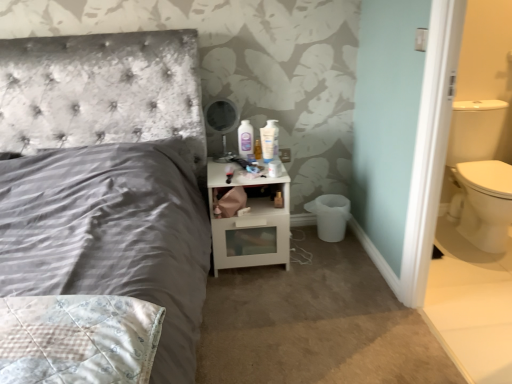
Question: Is white matte toilet paper at lower right looking in the opposite direction of white glossy mouthwash at upper center?

Choices:
 (A) no
 (B) yes

Answer: (A)

Question: From the image's perspective, does white matte toilet paper at lower right appear higher than white glossy mouthwash at upper center?

Choices:
 (A) no
 (B) yes

Answer: (A)

Question: Can you confirm if white matte toilet paper at lower right is smaller than white glossy mouthwash at upper center?

Choices:
 (A) no
 (B) yes

Answer: (B)

Question: Considering the relative sizes of white matte toilet paper at lower right and white glossy mouthwash at upper center in the image provided, is white matte toilet paper at lower right taller than white glossy mouthwash at upper center?

Choices:
 (A) yes
 (B) no

Answer: (B)

Question: Is white matte toilet paper at lower right wider than white glossy mouthwash at upper center?

Choices:
 (A) yes
 (B) no

Answer: (B)

Question: Is white matte toilet paper at lower right in front of white glossy mouthwash at upper center?

Choices:
 (A) no
 (B) yes

Answer: (B)

Question: Is white glossy nightstand at center to the left of white glossy mouthwash at upper center from the viewer's perspective?

Choices:
 (A) yes
 (B) no

Answer: (A)

Question: From the image's perspective, is white glossy nightstand at center beneath white glossy mouthwash at upper center?

Choices:
 (A) yes
 (B) no

Answer: (A)

Question: Does white glossy nightstand at center come behind white glossy mouthwash at upper center?

Choices:
 (A) no
 (B) yes

Answer: (A)

Question: Can you confirm if white glossy nightstand at center is bigger than white glossy mouthwash at upper center?

Choices:
 (A) yes
 (B) no

Answer: (A)

Question: Considering the relative sizes of white glossy nightstand at center and white glossy mouthwash at upper center in the image provided, is white glossy nightstand at center thinner than white glossy mouthwash at upper center?

Choices:
 (A) yes
 (B) no

Answer: (B)

Question: From a real-world perspective, is white glossy nightstand at center physically below white glossy mouthwash at upper center?

Choices:
 (A) yes
 (B) no

Answer: (A)

Question: From the image's perspective, is white glossy mouthwash at upper center over white glossy nightstand at center?

Choices:
 (A) yes
 (B) no

Answer: (A)